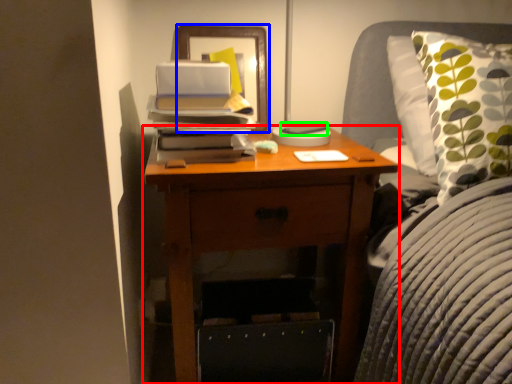
Question: Based on their relative distances, which object is nearer to nightstand (highlighted by a red box)? Choose from picture frame (highlighted by a blue box) and paperback book (highlighted by a green box).

Choices:
 (A) picture frame
 (B) paperback book

Answer: (A)